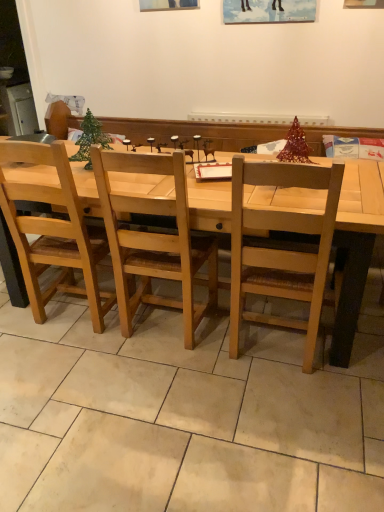
Where is `vacant space to the right of light brown wood chair at center, the second chair positioned from the right`? The image size is (384, 512). vacant space to the right of light brown wood chair at center, the second chair positioned from the right is located at coordinates (146, 331).